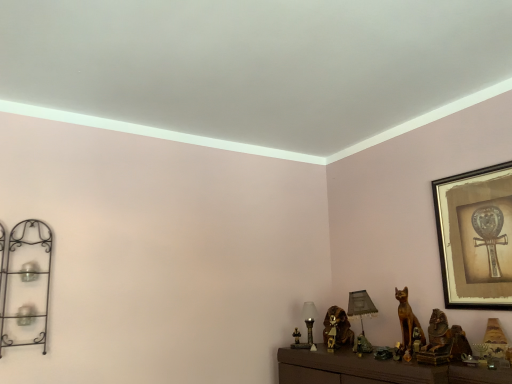
What do you see at coordinates (407, 321) in the screenshot?
I see `golden wood cat at lower right, marked as the second animal in a left-to-right arrangement` at bounding box center [407, 321].

Describe the element at coordinates (339, 327) in the screenshot. The image size is (512, 384). I see `brown metallic cat at center, which is the 1th animal in left-to-right order` at that location.

Find the location of a particular element. The image size is (512, 384). brown metallic cat at center, the 2th animal from the front is located at coordinates (339, 327).

This screenshot has height=384, width=512. Describe the element at coordinates (25, 283) in the screenshot. I see `black wrought iron shelf at left` at that location.

Locate an element on the screen. matte gray lampshade at center, the first table lamp when ordered from right to left is located at coordinates (361, 317).

Image resolution: width=512 pixels, height=384 pixels. What do you see at coordinates (309, 322) in the screenshot?
I see `matte glass table lamp at center, the 2th table lamp in the right-to-left sequence` at bounding box center [309, 322].

Where is `golden wood cat at lower right, marked as the second animal in a left-to-right arrangement`? The height and width of the screenshot is (384, 512). golden wood cat at lower right, marked as the second animal in a left-to-right arrangement is located at coordinates (407, 321).

Does matte glass table lamp at center, the 1th table lamp from the left, have a greater height compared to matte gray lampshade at center, the first table lamp when ordered from right to left?

In fact, matte glass table lamp at center, the 1th table lamp from the left, may be shorter than matte gray lampshade at center, the first table lamp when ordered from right to left.

Considering the relative positions of matte glass table lamp at center, the 1th table lamp from the left, and matte gray lampshade at center, the first table lamp when ordered from right to left, in the image provided, is matte glass table lamp at center, the 1th table lamp from the left, to the left of matte gray lampshade at center, the first table lamp when ordered from right to left, from the viewer's perspective?

Yes, matte glass table lamp at center, the 1th table lamp from the left, is to the left of matte gray lampshade at center, the first table lamp when ordered from right to left.

From the image's perspective, is matte glass table lamp at center, the 2th table lamp in the right-to-left sequence, located above or below matte gray lampshade at center, the 2th table lamp viewed from the left?

matte glass table lamp at center, the 2th table lamp in the right-to-left sequence, is below matte gray lampshade at center, the 2th table lamp viewed from the left.

Is matte glass table lamp at center, the 2th table lamp in the right-to-left sequence, aimed at matte gray lampshade at center, the 2th table lamp viewed from the left?

No.

Between black wrought iron shelf at left and golden wood cat at lower right, the first animal in the right-to-left sequence, which one has smaller size?

With smaller size is golden wood cat at lower right, the first animal in the right-to-left sequence.

From a real-world perspective, is black wrought iron shelf at left on golden wood cat at lower right, marked as the second animal in a left-to-right arrangement?

Yes, from a real-world perspective, black wrought iron shelf at left is above golden wood cat at lower right, marked as the second animal in a left-to-right arrangement.

How many degrees apart are the facing directions of black wrought iron shelf at left and golden wood cat at lower right, arranged as the second animal when viewed from the back?

81.8 degrees.

Does black wrought iron shelf at left have a greater height compared to golden wood cat at lower right, the 1th animal from the front?

Yes, black wrought iron shelf at left is taller than golden wood cat at lower right, the 1th animal from the front.

Can you confirm if golden wood cat at lower right, marked as the second animal in a left-to-right arrangement, is positioned to the right of matte glass table lamp at center, the 2th table lamp in the right-to-left sequence?

Indeed, golden wood cat at lower right, marked as the second animal in a left-to-right arrangement, is positioned on the right side of matte glass table lamp at center, the 2th table lamp in the right-to-left sequence.

Locate an element on the screen. animal above the matte glass table lamp at center, the 2th table lamp in the right-to-left sequence (from a real-world perspective) is located at coordinates (407, 321).

Is the depth of golden wood cat at lower right, arranged as the second animal when viewed from the back, less than that of matte glass table lamp at center, the 1th table lamp from the left?

Yes.

Which is in front, point (409, 305) or point (314, 347)?

The point (409, 305) is in front.

How distant is matte glass table lamp at center, the 2th table lamp in the right-to-left sequence, from gold-framed artwork at upper right?

A distance of 86.20 centimeters exists between matte glass table lamp at center, the 2th table lamp in the right-to-left sequence, and gold-framed artwork at upper right.

How different are the orientations of matte glass table lamp at center, the 2th table lamp in the right-to-left sequence, and gold-framed artwork at upper right in degrees?

There is a 3.09-degree angle between the facing directions of matte glass table lamp at center, the 2th table lamp in the right-to-left sequence, and gold-framed artwork at upper right.

Is matte glass table lamp at center, the 2th table lamp in the right-to-left sequence, taller or shorter than gold-framed artwork at upper right?

matte glass table lamp at center, the 2th table lamp in the right-to-left sequence, is shorter than gold-framed artwork at upper right.

From the image's perspective, which one is positioned lower, matte glass table lamp at center, the 2th table lamp in the right-to-left sequence, or gold-framed artwork at upper right?

matte glass table lamp at center, the 2th table lamp in the right-to-left sequence, from the image's perspective.

Is brown metallic cat at center, which is the 2th animal from right to left, surrounding golden wood cat at lower right, arranged as the second animal when viewed from the back?

No, golden wood cat at lower right, arranged as the second animal when viewed from the back, is not a part of brown metallic cat at center, which is the 2th animal from right to left.

Which is in front, brown metallic cat at center, which is the 1th animal in left-to-right order, or golden wood cat at lower right, arranged as the second animal when viewed from the back?

golden wood cat at lower right, arranged as the second animal when viewed from the back, is in front.

Which object is positioned more to the right, brown metallic cat at center, which is counted as the 1th animal, starting from the back, or golden wood cat at lower right, the 1th animal from the front?

From the viewer's perspective, golden wood cat at lower right, the 1th animal from the front, appears more on the right side.

From the image's perspective, is brown metallic cat at center, which is counted as the 1th animal, starting from the back, above or below matte gray lampshade at center, the first table lamp when ordered from right to left?

Clearly, from the image's perspective, brown metallic cat at center, which is counted as the 1th animal, starting from the back, is below matte gray lampshade at center, the first table lamp when ordered from right to left.

Is brown metallic cat at center, which is the 1th animal in left-to-right order, taller or shorter than matte gray lampshade at center, the first table lamp when ordered from right to left?

Clearly, brown metallic cat at center, which is the 1th animal in left-to-right order, is shorter compared to matte gray lampshade at center, the first table lamp when ordered from right to left.

Between brown metallic cat at center, which is the 2th animal from right to left, and matte gray lampshade at center, the first table lamp when ordered from right to left, which one appears on the right side from the viewer's perspective?

Positioned to the right is matte gray lampshade at center, the first table lamp when ordered from right to left.

Between brown metallic cat at center, which is counted as the 1th animal, starting from the back, and matte gray lampshade at center, the 2th table lamp viewed from the left, which one is positioned behind?

brown metallic cat at center, which is counted as the 1th animal, starting from the back.

From a real-world perspective, is gold-framed artwork at upper right under matte glass table lamp at center, the 1th table lamp from the left?

Incorrect, from a real-world perspective, gold-framed artwork at upper right is higher than matte glass table lamp at center, the 1th table lamp from the left.

Would you consider gold-framed artwork at upper right to be distant from matte glass table lamp at center, the 2th table lamp in the right-to-left sequence?

Actually, gold-framed artwork at upper right and matte glass table lamp at center, the 2th table lamp in the right-to-left sequence, are a little close together.

Does gold-framed artwork at upper right come behind matte glass table lamp at center, the 2th table lamp in the right-to-left sequence?

No, gold-framed artwork at upper right is closer to the camera.

Locate an element on the screen. table lamp that appears behind the matte gray lampshade at center, the first table lamp when ordered from right to left is located at coordinates (309, 322).

The image size is (512, 384). Identify the location of shelf in front of the golden wood cat at lower right, arranged as the second animal when viewed from the back. (25, 283).

Looking at the image, which one is located further to brown metallic cat at center, which is the 2th animal from right to left, gold-framed artwork at upper right or black wrought iron shelf at left?

black wrought iron shelf at left is further to brown metallic cat at center, which is the 2th animal from right to left.

Which object lies further to the anchor point gold-framed artwork at upper right, matte glass table lamp at center, the 1th table lamp from the left, or golden wood cat at lower right, the 1th animal from the front?

matte glass table lamp at center, the 1th table lamp from the left, is further to gold-framed artwork at upper right.

Estimate the real-world distances between objects in this image. Which object is closer to golden wood cat at lower right, the first animal in the right-to-left sequence, brown metallic cat at center, which is the 2th animal from right to left, or black wrought iron shelf at left?

Based on the image, brown metallic cat at center, which is the 2th animal from right to left, appears to be nearer to golden wood cat at lower right, the first animal in the right-to-left sequence.

When comparing their distances from golden wood cat at lower right, marked as the second animal in a left-to-right arrangement, does matte glass table lamp at center, the 1th table lamp from the left, or gold-framed artwork at upper right seem closer?

Among the two, gold-framed artwork at upper right is located nearer to golden wood cat at lower right, marked as the second animal in a left-to-right arrangement.

Looking at the image, which one is located closer to gold-framed artwork at upper right, golden wood cat at lower right, the 1th animal from the front, or matte glass table lamp at center, the 2th table lamp in the right-to-left sequence?

golden wood cat at lower right, the 1th animal from the front.

Considering their positions, is brown metallic cat at center, which is the 1th animal in left-to-right order, positioned further to matte glass table lamp at center, the 2th table lamp in the right-to-left sequence, than black wrought iron shelf at left?

Among the two, black wrought iron shelf at left is located further to matte glass table lamp at center, the 2th table lamp in the right-to-left sequence.

Estimate the real-world distances between objects in this image. Which object is further from black wrought iron shelf at left, matte gray lampshade at center, the 2th table lamp viewed from the left, or gold-framed artwork at upper right?

Among the two, gold-framed artwork at upper right is located further to black wrought iron shelf at left.

When comparing their distances from golden wood cat at lower right, marked as the second animal in a left-to-right arrangement, does gold-framed artwork at upper right or black wrought iron shelf at left seem further?

black wrought iron shelf at left lies further to golden wood cat at lower right, marked as the second animal in a left-to-right arrangement, than the other object.

I want to click on animal between matte glass table lamp at center, the 2th table lamp in the right-to-left sequence, and golden wood cat at lower right, the first animal in the right-to-left sequence, so click(x=339, y=327).

Where is `table lamp between matte glass table lamp at center, the 2th table lamp in the right-to-left sequence, and golden wood cat at lower right, arranged as the second animal when viewed from the back`? table lamp between matte glass table lamp at center, the 2th table lamp in the right-to-left sequence, and golden wood cat at lower right, arranged as the second animal when viewed from the back is located at coordinates tap(361, 317).

You are a GUI agent. You are given a task and a screenshot of the screen. Output one action in this format:
    pyautogui.click(x=<x>, y=<y>)
    Task: Click on the table lamp located between black wrought iron shelf at left and matte gray lampshade at center, the 2th table lamp viewed from the left, in the left-right direction
    The width and height of the screenshot is (512, 384).
    Given the screenshot: What is the action you would take?
    pyautogui.click(x=309, y=322)

Identify the location of animal that lies between gold-framed artwork at upper right and matte gray lampshade at center, the 2th table lamp viewed from the left, from top to bottom. (407, 321).